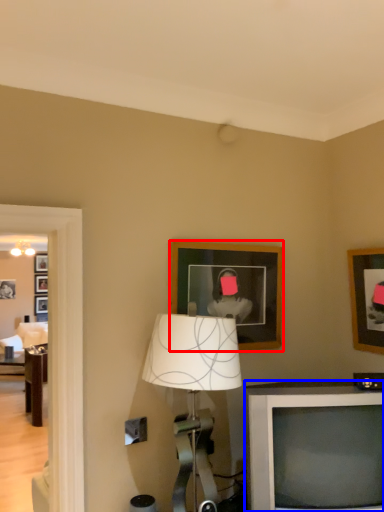
Question: Among these objects, which one is nearest to the camera, picture frame (highlighted by a red box) or television (highlighted by a blue box)?

Choices:
 (A) picture frame
 (B) television

Answer: (B)